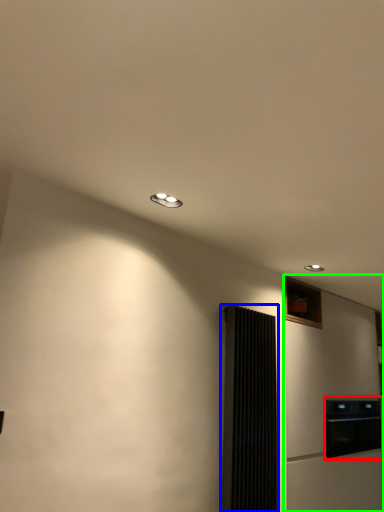
Question: Which is nearer to the appliance (highlighted by a red box)? screen door (highlighted by a blue box) or fridge (highlighted by a green box).

Choices:
 (A) screen door
 (B) fridge

Answer: (B)